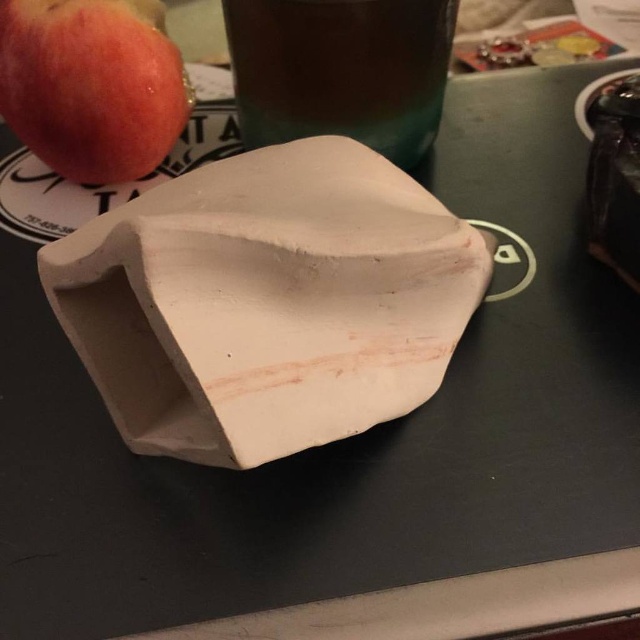
Who is shorter, translucent glass beverage at upper center or matte red apple at upper left?

With less height is translucent glass beverage at upper center.

Between point (413, 88) and point (154, 122), which one is positioned in front?

Point (154, 122) is more forward.

Where is `translucent glass beverage at upper center`? Image resolution: width=640 pixels, height=640 pixels. translucent glass beverage at upper center is located at coordinates (340, 70).

Is white clay vase at center taller than matte red apple at upper left?

Yes, white clay vase at center is taller than matte red apple at upper left.

Is white clay vase at center positioned before matte red apple at upper left?

Yes.

Find the location of a particular element. The image size is (640, 640). white clay vase at center is located at coordinates (266, 301).

Is white clay vase at center taller than translucent glass beverage at upper center?

Yes, white clay vase at center is taller than translucent glass beverage at upper center.

Does point (316, 236) come closer to viewer compared to point (371, 140)?

Yes, it is in front of point (371, 140).

Identify the location of white clay vase at center. (266, 301).